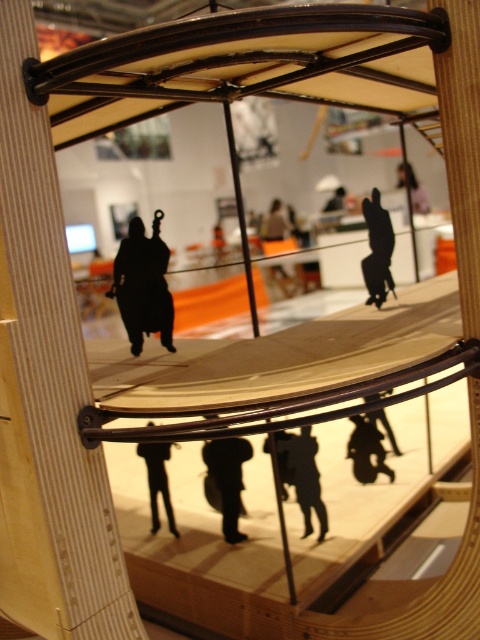
Question: Is the position of black matte figure at upper right more distant than that of black matte pants at center?

Choices:
 (A) no
 (B) yes

Answer: (A)

Question: Can you confirm if black matte person at center is positioned to the left of black matte pants at center?

Choices:
 (A) no
 (B) yes

Answer: (A)

Question: Which point is farther to the camera?

Choices:
 (A) wooden figure at center
 (B) black matte figure at upper right

Answer: (A)

Question: Is black matte motorcycle at lower center to the left of black matte pants at center from the viewer's perspective?

Choices:
 (A) no
 (B) yes

Answer: (A)

Question: Which is farther from the wooden figure at center?

Choices:
 (A) dark matte figure at center
 (B) black matte figure at upper right

Answer: (A)

Question: Among these objects, which one is nearest to the camera?

Choices:
 (A) black matte figure at upper right
 (B) dark matte figure at center
 (C) black matte motorcycle at lower center
 (D) black matte figure at center

Answer: (D)